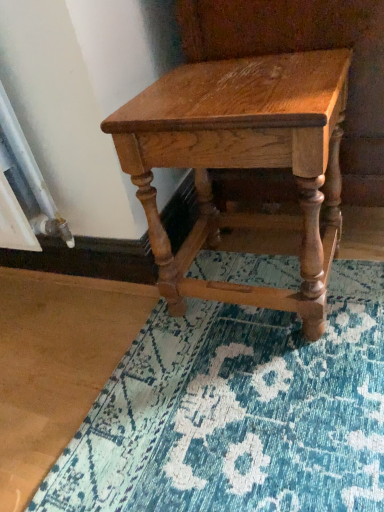
What are the coordinates of `empty space that is ontop of shiny oak table at center (from a real-world perspective)` in the screenshot? It's located at (226, 91).